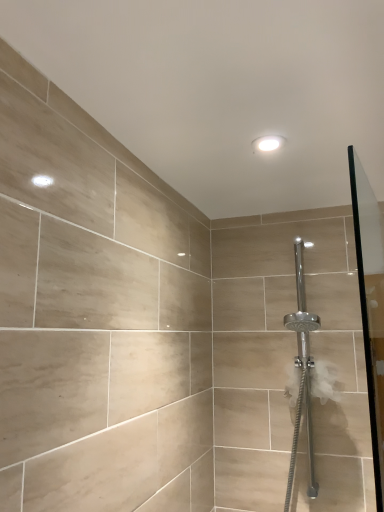
Locate an element on the screen. white glossy light fixture at upper center is located at coordinates (268, 143).

Describe the element at coordinates (268, 143) in the screenshot. I see `white glossy light fixture at upper center` at that location.

Find the location of a particular element. The height and width of the screenshot is (512, 384). white glossy light fixture at upper center is located at coordinates (268, 143).